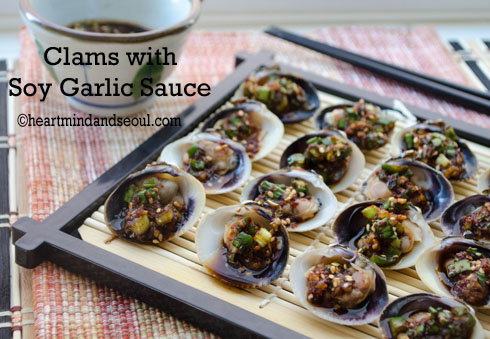
Identify the location of tray. (45, 243).